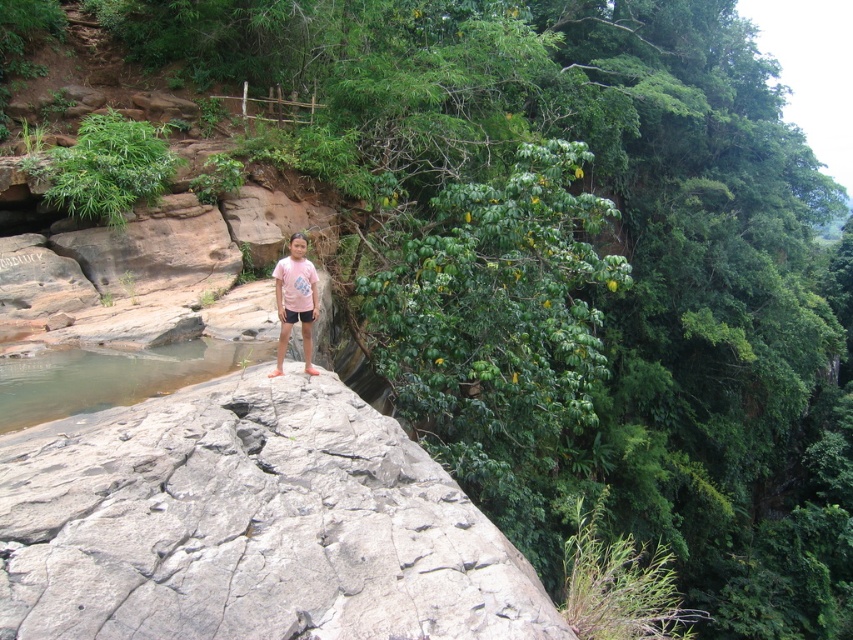
You are a photographer positioned at the cliff edge. You want to capture both the point at coordinates point [260,442] and point [181,349] in your shot. Which point will appear larger in your photo?

Point [260,442] is closer to the camera than point [181,349], so it will appear larger in the photo.

You are a geologist examining the cliffside. You need to determine which object, the gray rough rock at center or the clear water at rock edge, is wider. Based on the scene description, which one is wider?

The gray rough rock at center is wider than the clear water at rock edge because the gray rough rock at center surpasses the clear water at rock edge in width according to the description.

You are a geologist examining the cliffside. You notice the gray rough rock at center and the clear water at rock edge. Which of these two is higher in elevation?

The gray rough rock at center is much taller than the clear water at rock edge, so it has a higher elevation.